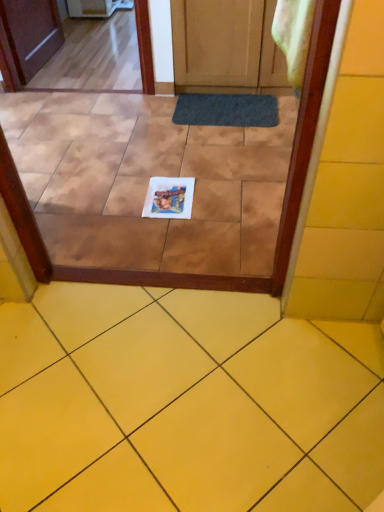
Where is `free area in between dark gray rubber doormat at center and white glossy coaster at center`? The height and width of the screenshot is (512, 384). free area in between dark gray rubber doormat at center and white glossy coaster at center is located at coordinates (210, 151).